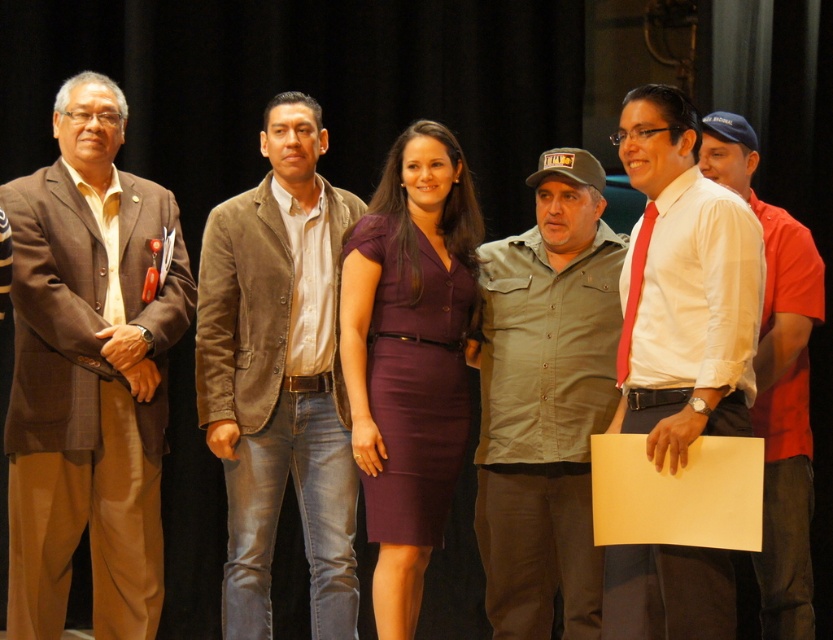
You are a photographer setting up for a group photo. You need to ensure that the suede jacket at center and the brown leather jacket at left are both visible in the frame. Based on their sizes, which jacket might require you to adjust your camera angle to avoid being obscured?

The suede jacket at center is taller than the brown leather jacket at left, so the suede jacket at center might require adjusting the camera angle to ensure it doesn not obscure the shorter brown leather jacket at left.